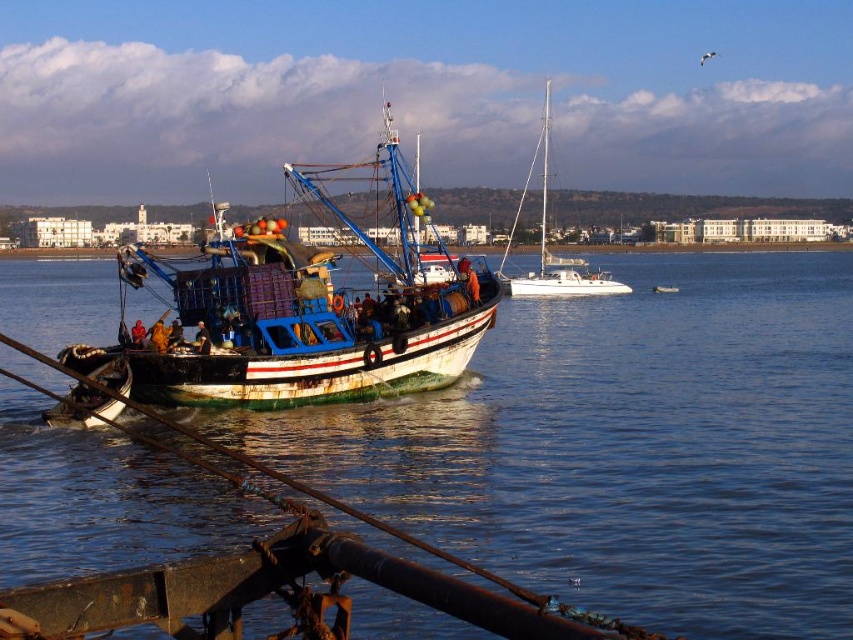
You are standing on the deck of the fishing boat and looking out. You see the blue water at center and the white glossy sailboat at center. Which one is closer to you?

The blue water at center is closer to you because it is in front of the white glossy sailboat at center.

You are a seagull flying above the water. You want to land on the tallest object between the rusty metal boat at center and the white glossy sailboat at center. Which one should you choose?

The rusty metal boat at center is much taller than the white glossy sailboat at center, so you should land on the rusty metal boat at center.